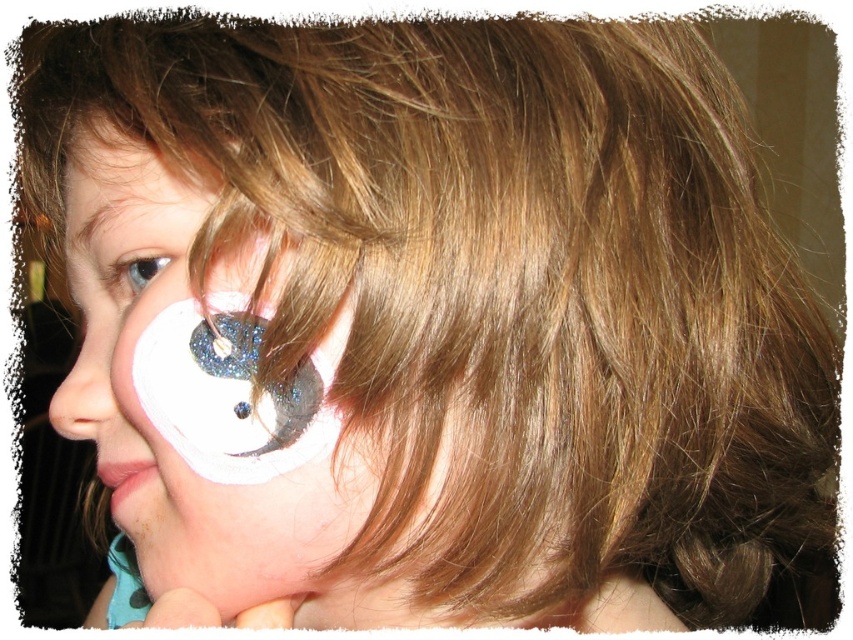
Question: Can you confirm if matte white nose at lower left is positioned above white glittery eye at upper left?

Choices:
 (A) no
 (B) yes

Answer: (A)

Question: Can you confirm if white matte face paint at center is positioned to the left of white glittery eye at upper left?

Choices:
 (A) yes
 (B) no

Answer: (B)

Question: Which point is closer to the camera?

Choices:
 (A) (141, 224)
 (B) (148, 273)
 (C) (146, 440)
 (D) (103, 342)

Answer: (A)

Question: Among these objects, which one is nearest to the camera?

Choices:
 (A) white matte face paint at center
 (B) white glittery eye at upper left
 (C) white matte face paint at upper left
 (D) brown matte eyebrow at upper left

Answer: (A)

Question: Based on their relative distances, which object is nearer to the matte white nose at lower left?

Choices:
 (A) brown matte eyebrow at upper left
 (B) white matte face paint at upper left
 (C) white matte face paint at center
 (D) white glittery eye at upper left

Answer: (D)

Question: Does white matte face paint at center appear on the left side of white matte face paint at upper left?

Choices:
 (A) yes
 (B) no

Answer: (B)